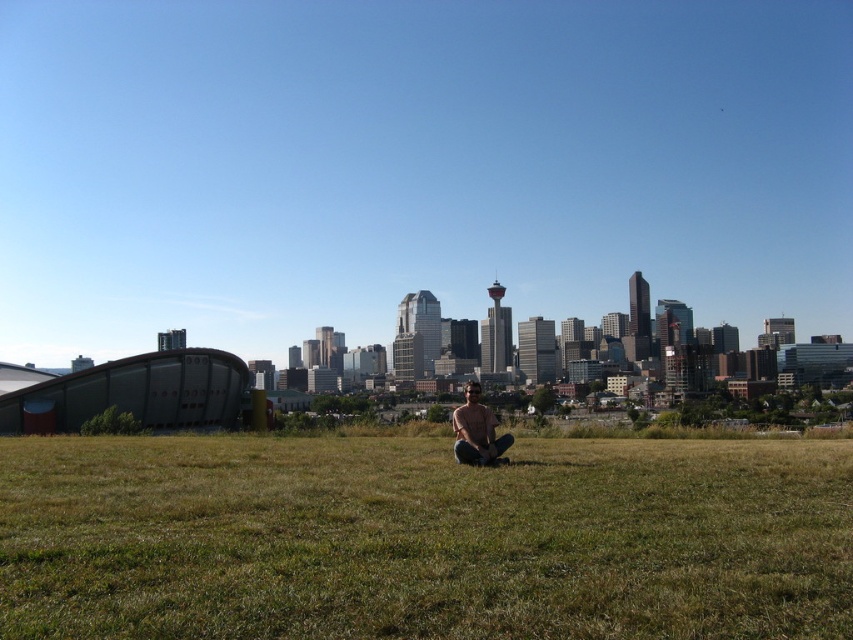
Is point (766, 630) positioned before point (459, 440)?

Yes, it is.

Which is in front, point (271, 486) or point (468, 419)?

Point (271, 486)

Does point (80, 513) come in front of point (486, 429)?

Yes, it is.

The height and width of the screenshot is (640, 853). I want to click on green grass at center, so click(x=422, y=538).